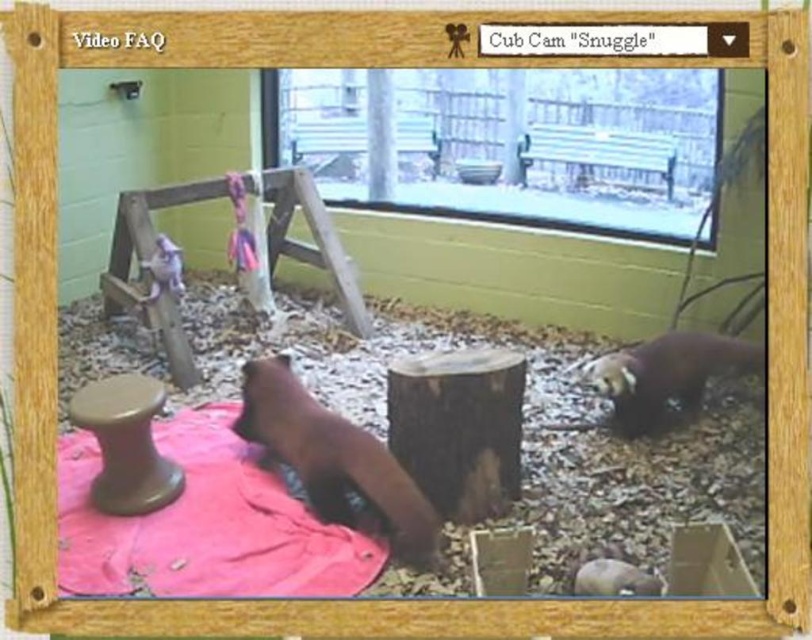
Question: Does pink fabric at lower left appear over matte brown stool at lower left?

Choices:
 (A) yes
 (B) no

Answer: (B)

Question: Can you confirm if pink fabric at lower left is positioned below brown furry bear at lower right?

Choices:
 (A) no
 (B) yes

Answer: (B)

Question: Which of these objects is positioned farthest from the pink fabric at lower left?

Choices:
 (A) brown furry bear at lower right
 (B) brown furry animal at center
 (C) matte brown stool at lower left

Answer: (A)

Question: Can you confirm if brown furry animal at center is positioned above brown furry bear at lower right?

Choices:
 (A) yes
 (B) no

Answer: (B)

Question: Which of the following is the closest to the observer?

Choices:
 (A) matte brown stool at lower left
 (B) pink fabric at lower left
 (C) brown furry bear at lower right
 (D) brown furry animal at center

Answer: (B)

Question: Which object is positioned farthest from the matte brown stool at lower left?

Choices:
 (A) pink fabric at lower left
 (B) brown furry animal at center
 (C) brown furry bear at lower right

Answer: (C)